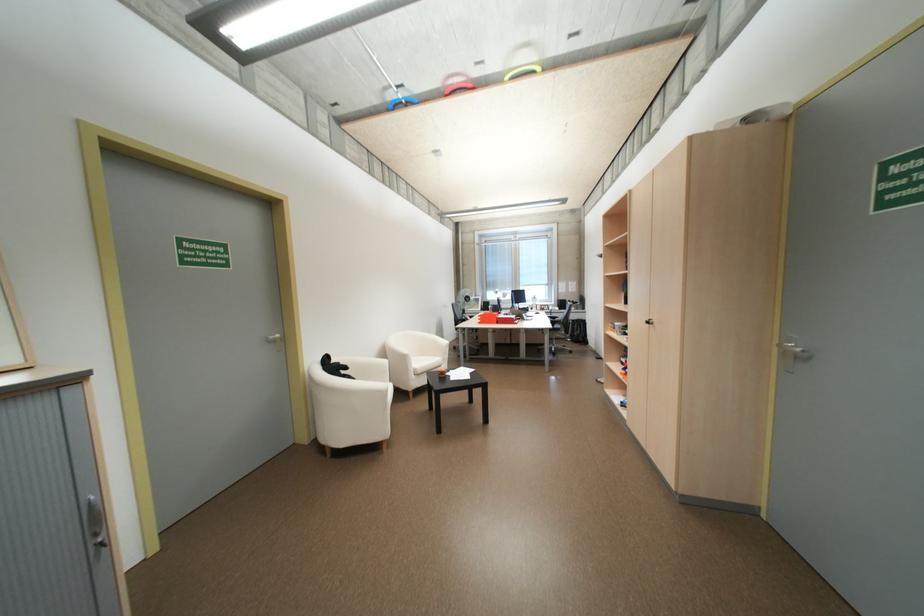
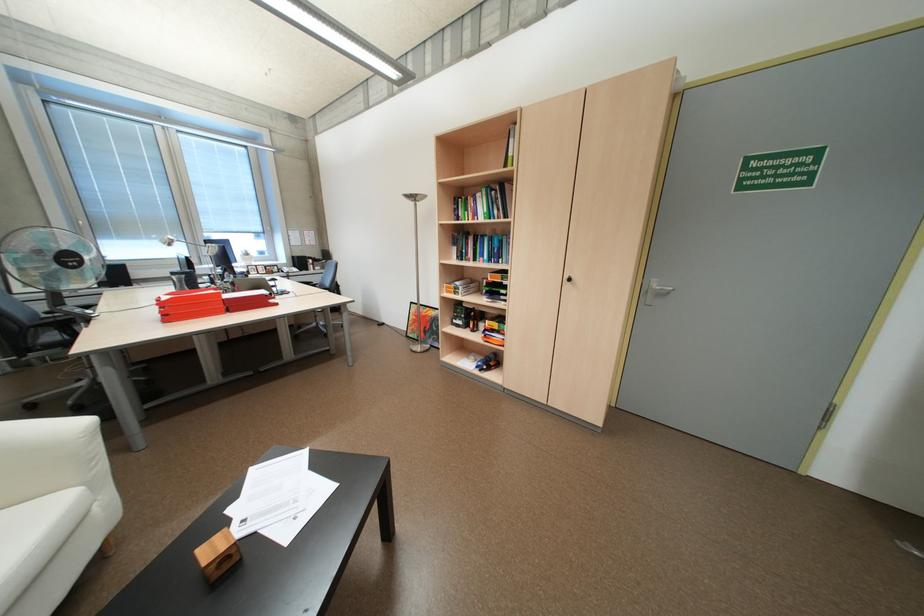
Find the pixel in the second image that matches (x=633, y=363) in the first image.

(468, 325)